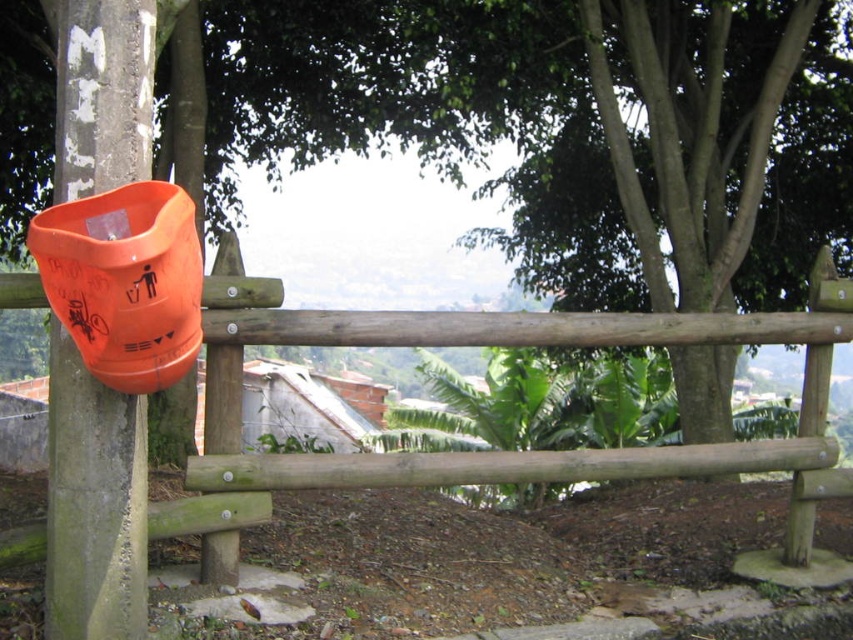
Question: Is wooden fence at center smaller than orange matte plastic trash can at left?

Choices:
 (A) yes
 (B) no

Answer: (B)

Question: Which point appears closest to the camera in this image?

Choices:
 (A) (136, 586)
 (B) (84, 188)

Answer: (B)

Question: Does wooden fence at center appear on the left side of orange matte plastic trash can at left?

Choices:
 (A) yes
 (B) no

Answer: (B)

Question: Is the position of wooden fence at center less distant than that of orange matte plastic trash can at left?

Choices:
 (A) yes
 (B) no

Answer: (B)